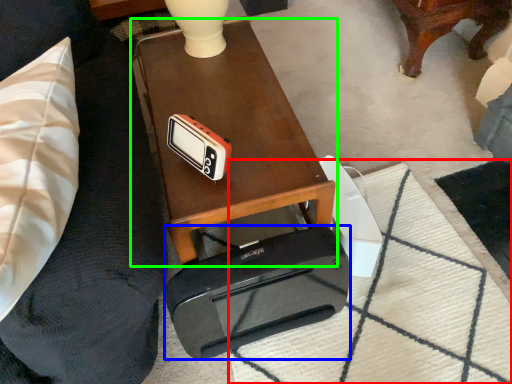
Question: Which object is positioned closest to mat (highlighted by a red box)? Select from cassette (highlighted by a blue box) and table (highlighted by a green box).

Choices:
 (A) cassette
 (B) table

Answer: (A)